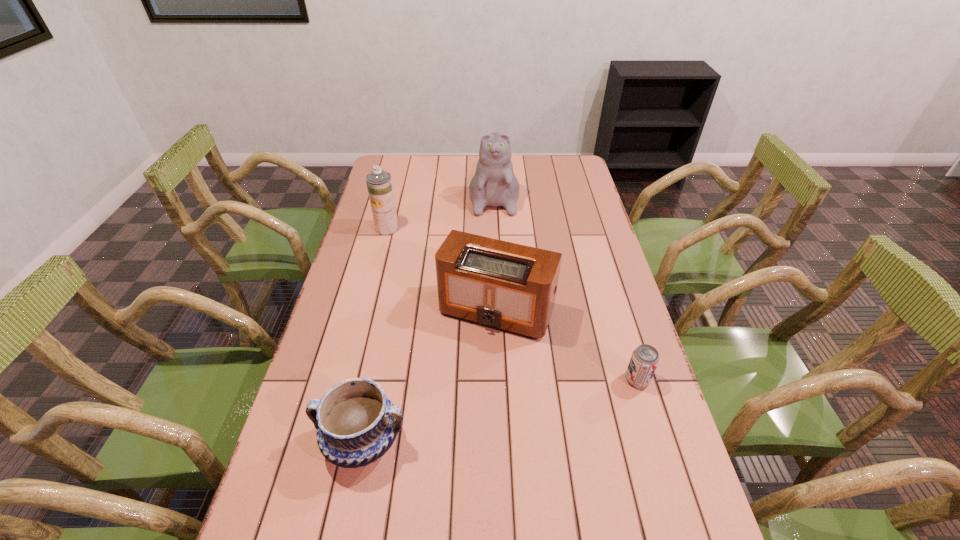
Identify the location of cat. point(494,184).

Find the location of a particular element. The image size is (960, 540). the second farthest object is located at coordinates (379, 183).

Find the location of a particular element. radio receiver is located at coordinates (506, 286).

This screenshot has width=960, height=540. Find the location of `the third nearest object`. the third nearest object is located at coordinates (506, 286).

Identify the location of the fourth tallest object. The image size is (960, 540). (356, 423).

Find the location of a particular element. Image resolution: width=960 pixels, height=540 pixels. pottery is located at coordinates (356, 423).

Image resolution: width=960 pixels, height=540 pixels. Find the location of `the shortest object`. the shortest object is located at coordinates (644, 360).

Where is `beer can`? The image size is (960, 540). beer can is located at coordinates (644, 360).

Image resolution: width=960 pixels, height=540 pixels. I want to click on free space located 0.180m on the face of the farthest object, so click(x=496, y=247).

Where is `free space located on the back of the aerosol can`? The width and height of the screenshot is (960, 540). free space located on the back of the aerosol can is located at coordinates (402, 171).